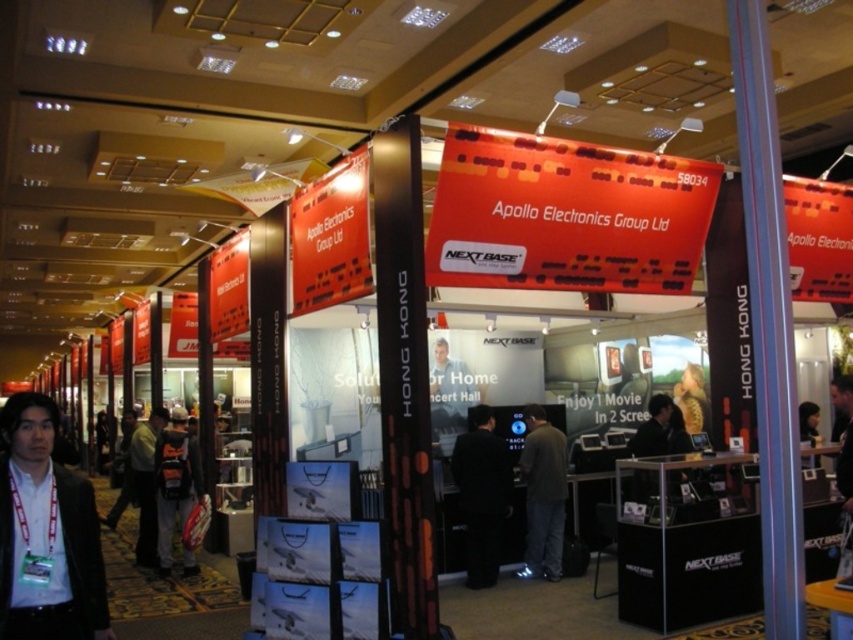
You are an attendee at the exhibition hall and want to pick up a promotional item from the booth. You see a matte black suit at lower left and an orange fabric backpack at center. Which item is easier to reach without moving from your current position?

The matte black suit at lower left is closer to the viewer than the orange fabric backpack at center, so it is easier to reach without moving from your current position.

You are standing in front of the Apollo Electronics Group Ltd booth at the exhibition hall. You notice two points marked on the backdrop. The first point is at coordinate (160,445) and the second is at (148,424). If you were to walk towards the booth, which point would appear closer to you?

Point (160,445) is closer to the viewer than point (148,424), so it would appear closer when you walk towards the booth.